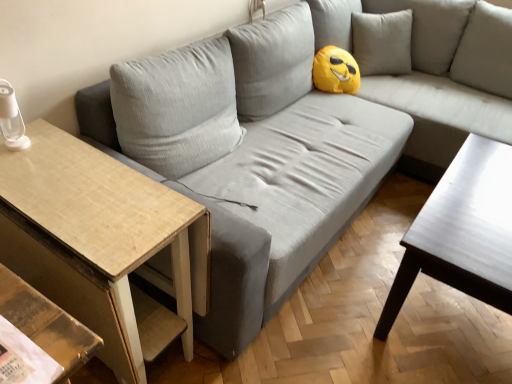
Question: From the image's perspective, is shiny dark wood coffee table at right on top of wooden textured table at left?

Choices:
 (A) no
 (B) yes

Answer: (B)

Question: Is shiny dark wood coffee table at right shorter than wooden textured table at left?

Choices:
 (A) no
 (B) yes

Answer: (B)

Question: Can you confirm if shiny dark wood coffee table at right is positioned to the right of wooden textured table at left?

Choices:
 (A) no
 (B) yes

Answer: (B)

Question: Is shiny dark wood coffee table at right oriented away from wooden textured table at left?

Choices:
 (A) no
 (B) yes

Answer: (A)

Question: From the image's perspective, is shiny dark wood coffee table at right beneath wooden textured table at left?

Choices:
 (A) yes
 (B) no

Answer: (B)

Question: Does shiny dark wood coffee table at right appear on the left side of wooden textured table at left?

Choices:
 (A) yes
 (B) no

Answer: (B)

Question: Is wooden textured table at left wider than shiny dark wood coffee table at right?

Choices:
 (A) yes
 (B) no

Answer: (A)

Question: Is shiny dark wood coffee table at right inside wooden textured table at left?

Choices:
 (A) yes
 (B) no

Answer: (B)

Question: From a real-world perspective, is wooden textured table at left positioned over shiny dark wood coffee table at right based on gravity?

Choices:
 (A) no
 (B) yes

Answer: (B)

Question: Considering the relative positions of wooden textured table at left and shiny dark wood coffee table at right in the image provided, is wooden textured table at left to the left of shiny dark wood coffee table at right from the viewer's perspective?

Choices:
 (A) no
 (B) yes

Answer: (B)

Question: Can you see wooden textured table at left touching shiny dark wood coffee table at right?

Choices:
 (A) no
 (B) yes

Answer: (A)

Question: Is wooden textured table at left facing towards shiny dark wood coffee table at right?

Choices:
 (A) no
 (B) yes

Answer: (A)

Question: In the image, is shiny dark wood coffee table at right on the left side or the right side of wooden textured table at left?

Choices:
 (A) right
 (B) left

Answer: (A)